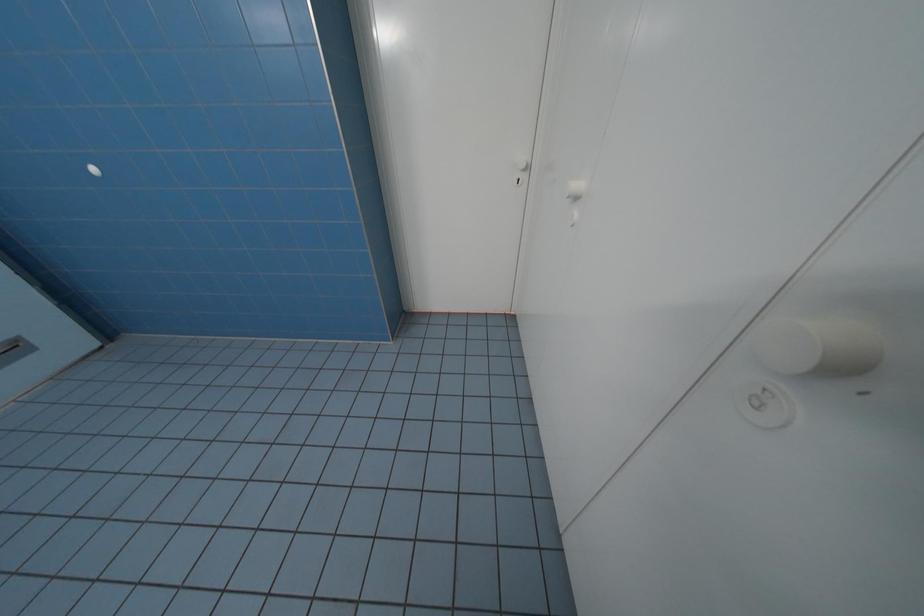
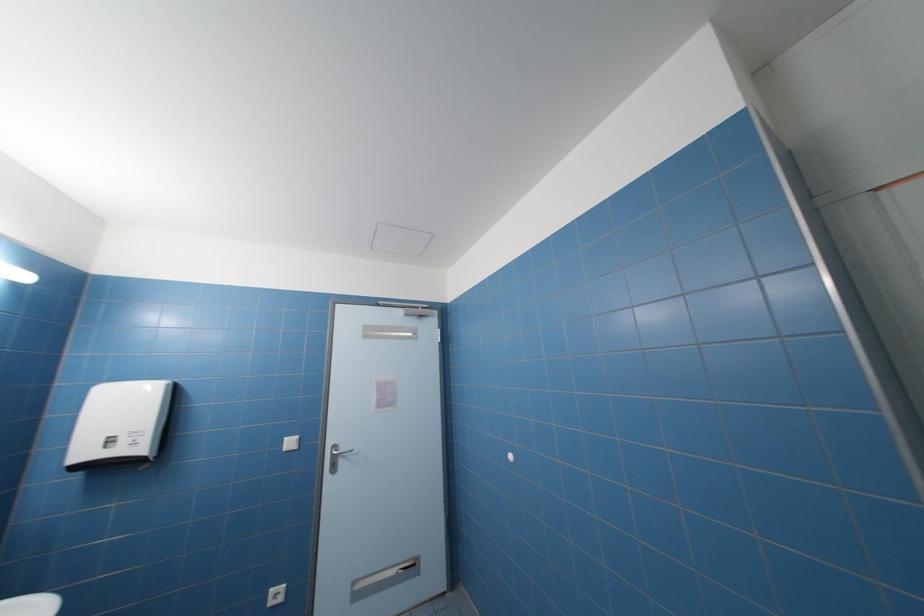
First-person continuous shooting, in which direction is the camera rotating?

The camera rotated toward left-up.